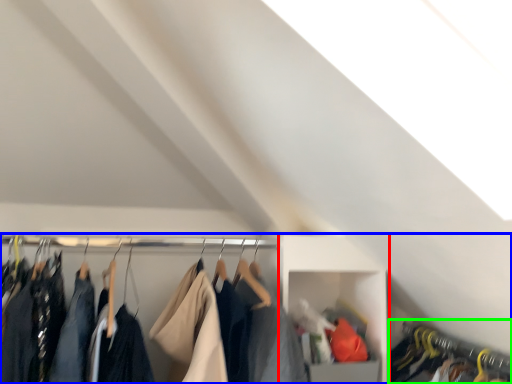
Question: Which is nearer to the cabinet (highlighted by a red box)? closet (highlighted by a blue box) or closet (highlighted by a green box).

Choices:
 (A) closet
 (B) closet

Answer: (A)